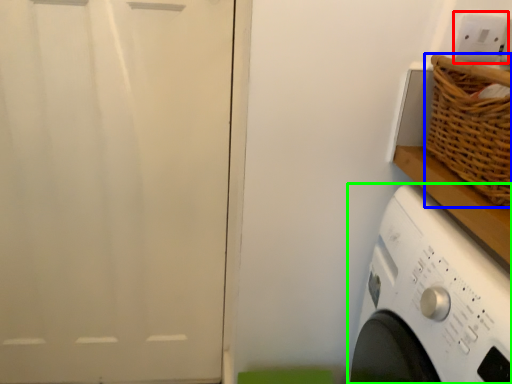
Question: Which is farther away from electric outlet (highlighted by a red box)? basket (highlighted by a blue box) or washing machine (highlighted by a green box)?

Choices:
 (A) basket
 (B) washing machine

Answer: (B)